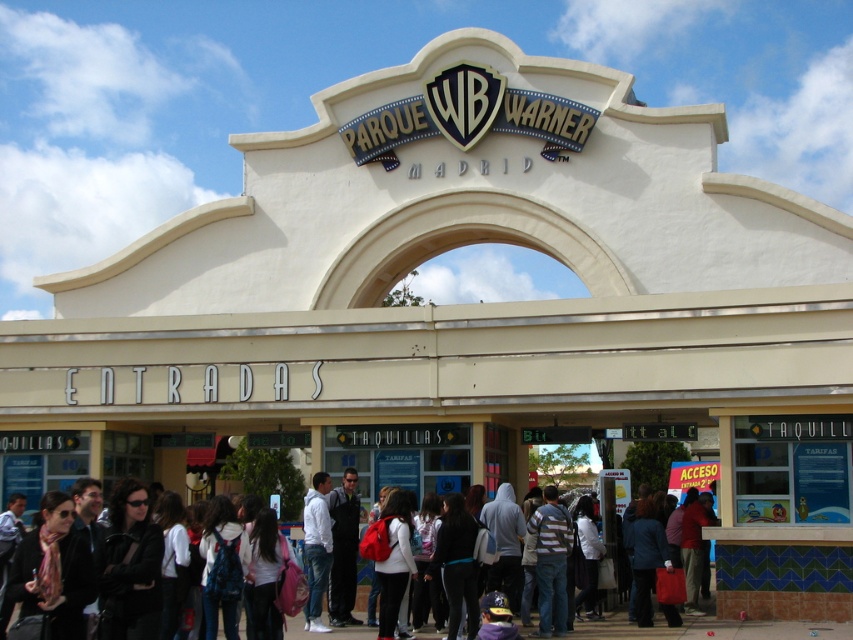
Question: Is striped shirt at center smaller than dark gray fabric jacket at center?

Choices:
 (A) yes
 (B) no

Answer: (B)

Question: Does striped shirt at center have a larger size compared to dark gray fabric jacket at center?

Choices:
 (A) no
 (B) yes

Answer: (B)

Question: Which object is the closest to the white cotton shirt at center?

Choices:
 (A) white matte jacket at center
 (B) dark gray fabric jacket at center
 (C) striped shirt at center

Answer: (C)

Question: Which object is closer to the camera taking this photo?

Choices:
 (A) striped shirt at center
 (B) white cotton shirt at center

Answer: (B)

Question: Does striped shirt at center have a larger size compared to dark gray fabric jacket at center?

Choices:
 (A) yes
 (B) no

Answer: (A)

Question: Which object is farther from the camera taking this photo?

Choices:
 (A) dark gray fabric jacket at center
 (B) white matte jacket at center
 (C) striped shirt at center
 (D) white cotton shirt at center

Answer: (A)